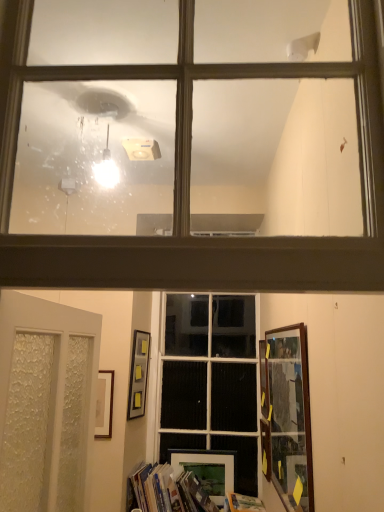
Identify the location of hardcover book at lower center. Image resolution: width=384 pixels, height=512 pixels. (245, 503).

Where is `white glass window at center, the 2th window viewed from the top`? This screenshot has width=384, height=512. white glass window at center, the 2th window viewed from the top is located at coordinates (209, 380).

How much space does matte glass window at upper center, the 1th window when ordered from top to bottom, occupy vertically?

It is 23.92 inches.

Describe the element at coordinates (46, 403) in the screenshot. I see `white frosted glass door at lower left` at that location.

The height and width of the screenshot is (512, 384). Describe the element at coordinates (167, 490) in the screenshot. I see `hardcover book at lower center` at that location.

Where is `wooden picture frame at right, the 1th picture frame viewed from the front`? The height and width of the screenshot is (512, 384). wooden picture frame at right, the 1th picture frame viewed from the front is located at coordinates (290, 416).

Describe the element at coordinates (290, 416) in the screenshot. I see `wooden picture frame at right, which ranks as the fourth picture frame in back-to-front order` at that location.

Where is `hardcover book at lower center`? hardcover book at lower center is located at coordinates (245, 503).

Based on the photo, does wooden picture frame at lower right, acting as the 4th picture frame starting from the left, appear on the left side of wooden picture frame at right, the 3th picture frame from the left?

Incorrect, wooden picture frame at lower right, acting as the 4th picture frame starting from the left, is not on the left side of wooden picture frame at right, the 3th picture frame from the left.

Considering the sizes of wooden picture frame at lower right, acting as the 4th picture frame starting from the left, and wooden picture frame at right, the 3th picture frame from the left, in the image, is wooden picture frame at lower right, acting as the 4th picture frame starting from the left, taller or shorter than wooden picture frame at right, the 3th picture frame from the left,?

wooden picture frame at lower right, acting as the 4th picture frame starting from the left, is shorter than wooden picture frame at right, the 3th picture frame from the left.

The image size is (384, 512). There is a wooden picture frame at right, which ranks as the fourth picture frame in back-to-front order. In order to click on the 1st picture frame below it (from a real-world perspective) in this screenshot , I will do `click(265, 448)`.

Is wooden picture frame at right, which ranks as the fourth picture frame in back-to-front order, located within wooden picture frame at lower right, acting as the 4th picture frame starting from the left?

No.

From a real-world perspective, who is located higher, hardcover book at lower center or wooden picture frame at right, the 1th picture frame viewed from the front?

wooden picture frame at right, the 1th picture frame viewed from the front, is physically above.

Considering the relative positions of hardcover book at lower center and wooden picture frame at right, the 3th picture frame from the left, in the image provided, is hardcover book at lower center to the right of wooden picture frame at right, the 3th picture frame from the left, from the viewer's perspective?

No, hardcover book at lower center is not to the right of wooden picture frame at right, the 3th picture frame from the left.

Is hardcover book at lower center not close to wooden picture frame at right, the second picture frame in the right-to-left sequence?

Yes, hardcover book at lower center is far from wooden picture frame at right, the second picture frame in the right-to-left sequence.

How many degrees apart are the facing directions of hardcover book at lower center and wooden picture frame at right, the 1th picture frame viewed from the front?

90.3 degrees.

Which object is thinner, white glass window at center, which is the 1th window in back-to-front order, or wooden picture frame at right, the 3th picture frame from the left?

With smaller width is wooden picture frame at right, the 3th picture frame from the left.

Starting from the wooden picture frame at right, the second picture frame in the right-to-left sequence, which window is the 1st one to the left? Please provide its 2D coordinates.

[(209, 380)]

Considering the sizes of white glass window at center, the 2th window viewed from the top, and wooden picture frame at right, the 3th picture frame from the left, in the image, is white glass window at center, the 2th window viewed from the top, bigger or smaller than wooden picture frame at right, the 3th picture frame from the left,?

Considering their sizes, white glass window at center, the 2th window viewed from the top, takes up more space than wooden picture frame at right, the 3th picture frame from the left.

From the picture: Is white glass window at center, which is the 1th window in back-to-front order, next to wooden picture frame at right, the 3th picture frame from the left, and touching it?

No, white glass window at center, which is the 1th window in back-to-front order, is not touching wooden picture frame at right, the 3th picture frame from the left.

Is point (131, 490) positioned behind point (267, 478)?

Yes, it is behind point (267, 478).

From a real-world perspective, is hardcover book at lower center on top of wooden picture frame at lower right, which is the second picture frame from front to back?

No.

Considering the relative sizes of hardcover book at lower center and wooden picture frame at lower right, which appears as the 1th picture frame when viewed from the right, in the image provided, is hardcover book at lower center shorter than wooden picture frame at lower right, which appears as the 1th picture frame when viewed from the right,?

No.

Based on the photo, can you confirm if hardcover book at lower center is smaller than wooden picture frame at lower right, the third picture frame positioned from the back?

No, hardcover book at lower center is not smaller than wooden picture frame at lower right, the third picture frame positioned from the back.

Which is closer to the camera, [237,495] or [265,475]?

Point [237,495] appears to be farther away from the viewer than point [265,475].

From the image's perspective, relative to wooden picture frame at lower right, which is the second picture frame from front to back, is hardcover book at lower center above or below?

Clearly, from the image's perspective, hardcover book at lower center is below wooden picture frame at lower right, which is the second picture frame from front to back.

Consider the image. From a real-world perspective, who is located higher, hardcover book at lower center or wooden picture frame at lower right, the third picture frame positioned from the back?

From a 3D spatial view, wooden picture frame at lower right, the third picture frame positioned from the back, is above.

Could you measure the distance between matte black picture frame at upper center, the 1th picture frame when ordered from left to right, and white glass window at center, which appears as the first window when ordered from the bottom?

matte black picture frame at upper center, the 1th picture frame when ordered from left to right, is 39.03 centimeters from white glass window at center, which appears as the first window when ordered from the bottom.

Considering the sizes of objects matte black picture frame at upper center, positioned as the fourth picture frame in right-to-left order, and white glass window at center, acting as the 2th window starting from the front, in the image provided, who is shorter, matte black picture frame at upper center, positioned as the fourth picture frame in right-to-left order, or white glass window at center, acting as the 2th window starting from the front,?

With less height is matte black picture frame at upper center, positioned as the fourth picture frame in right-to-left order.

The width and height of the screenshot is (384, 512). Identify the location of picture frame above the white glass window at center, which is the 1th window in back-to-front order (from a real-world perspective). tap(138, 375).

From a real-world perspective, is matte black picture frame at upper center, positioned as the 2th picture frame in back-to-front order, on white glass window at center, which appears as the first window when ordered from the bottom?

Yes, from a real-world perspective, matte black picture frame at upper center, positioned as the 2th picture frame in back-to-front order, is above white glass window at center, which appears as the first window when ordered from the bottom.

Between point (203, 463) and point (175, 492), which one is positioned in front?

Positioned in front is point (175, 492).

Considering the relative sizes of matte black picture frame at lower center, positioned as the 1th picture frame in back-to-front order, and hardcover book at lower center in the image provided, is matte black picture frame at lower center, positioned as the 1th picture frame in back-to-front order, taller than hardcover book at lower center?

Indeed, matte black picture frame at lower center, positioned as the 1th picture frame in back-to-front order, has a greater height compared to hardcover book at lower center.

From the picture: Considering the positions of objects matte black picture frame at lower center, which appears as the fourth picture frame when viewed from the front, and hardcover book at lower center in the image provided, who is behind, matte black picture frame at lower center, which appears as the fourth picture frame when viewed from the front, or hardcover book at lower center?

matte black picture frame at lower center, which appears as the fourth picture frame when viewed from the front, is behind.

Locate an element on the screen. picture frame that is the 1st object to the left of the wooden picture frame at lower right, the third picture frame positioned from the back, starting at the anchor is located at coordinates (290, 416).

The height and width of the screenshot is (512, 384). Find the location of `picture frame lying in front of the hardcover book at lower center`. picture frame lying in front of the hardcover book at lower center is located at coordinates (290, 416).

Based on their spatial positions, is white glass window at center, the 2th window viewed from the top, or matte black picture frame at upper center, positioned as the 2th picture frame in back-to-front order, further from matte glass window at upper center, the 2th window positioned from the back?

Based on the image, white glass window at center, the 2th window viewed from the top, appears to be further to matte glass window at upper center, the 2th window positioned from the back.

Looking at the image, which one is located further to matte glass window at upper center, the second window positioned from the bottom, matte black picture frame at lower center, positioned as the 1th picture frame in back-to-front order, or wooden picture frame at lower right, acting as the 4th picture frame starting from the left?

matte black picture frame at lower center, positioned as the 1th picture frame in back-to-front order.

When comparing their distances from matte black picture frame at upper center, positioned as the fourth picture frame in right-to-left order, does matte glass window at upper center, the second window positioned from the bottom, or hardcover book at lower center seem further?

Based on the image, matte glass window at upper center, the second window positioned from the bottom, appears to be further to matte black picture frame at upper center, positioned as the fourth picture frame in right-to-left order.

Based on their spatial positions, is white glass window at center, which is the 1th window in back-to-front order, or matte black picture frame at lower center, positioned as the 1th picture frame in back-to-front order, further from matte black picture frame at upper center, positioned as the 2th picture frame in back-to-front order?

The object further to matte black picture frame at upper center, positioned as the 2th picture frame in back-to-front order, is matte black picture frame at lower center, positioned as the 1th picture frame in back-to-front order.

Based on their spatial positions, is hardcover book at lower center or hardcover book at lower center further from white frosted glass door at lower left?

hardcover book at lower center.

Based on their spatial positions, is wooden picture frame at right, the 1th picture frame viewed from the front, or white frosted glass door at lower left closer to matte black picture frame at lower center, the third picture frame positioned from the right?

Among the two, wooden picture frame at right, the 1th picture frame viewed from the front, is located nearer to matte black picture frame at lower center, the third picture frame positioned from the right.

Based on their spatial positions, is matte black picture frame at upper center, positioned as the fourth picture frame in right-to-left order, or wooden picture frame at lower right, the third picture frame positioned from the back, closer to hardcover book at lower center?

matte black picture frame at upper center, positioned as the fourth picture frame in right-to-left order.

When comparing their distances from matte black picture frame at lower center, which ranks as the 2th picture frame in left-to-right order, does hardcover book at lower center or matte black picture frame at upper center, positioned as the fourth picture frame in right-to-left order, seem further?

The object further to matte black picture frame at lower center, which ranks as the 2th picture frame in left-to-right order, is matte black picture frame at upper center, positioned as the fourth picture frame in right-to-left order.

Where is `paperback book between white frosted glass door at lower left and hardcover book at lower center from front to back`? paperback book between white frosted glass door at lower left and hardcover book at lower center from front to back is located at coordinates 245,503.

The image size is (384, 512). What are the coordinates of `paperback book situated between matte black picture frame at upper center, positioned as the fourth picture frame in right-to-left order, and wooden picture frame at lower right, acting as the 4th picture frame starting from the left, from left to right` in the screenshot? It's located at coord(245,503).

Locate an element on the screen. The width and height of the screenshot is (384, 512). window located between white frosted glass door at lower left and hardcover book at lower center in the depth direction is located at coordinates (189, 186).

Locate an element on the screen. The image size is (384, 512). book between white glass window at center, which appears as the first window when ordered from the bottom, and hardcover book at lower center from top to bottom is located at coordinates (167, 490).